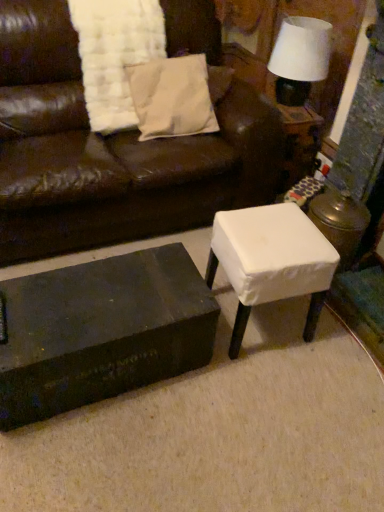
Find the location of a particular element. vacant area in front of black matte/wooden coffee table at lower left is located at coordinates (100, 455).